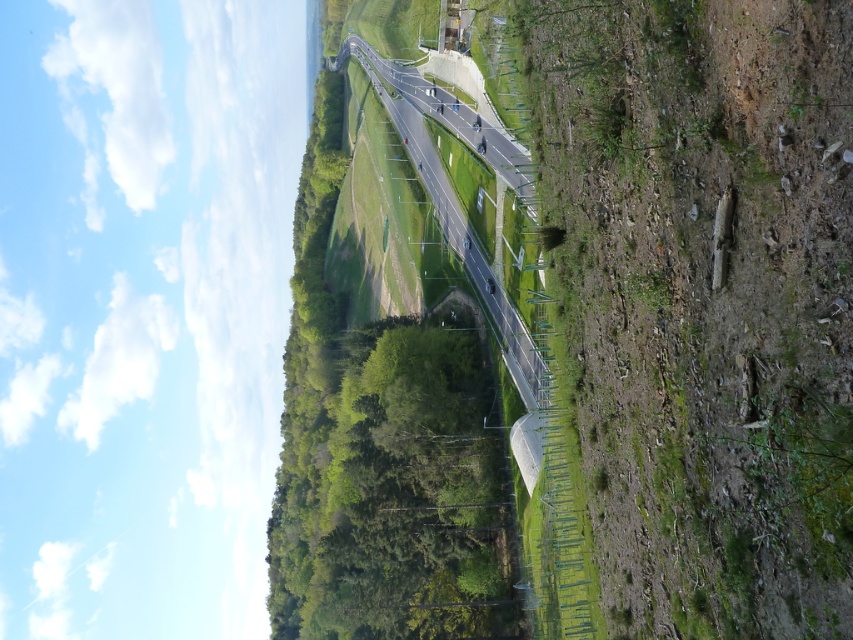
Between dull green grass at lower right and asphalt road at center, which one is positioned lower?

dull green grass at lower right is lower down.

Is dull green grass at lower right positioned in front of asphalt road at center?

Yes, it is in front of asphalt road at center.

Image resolution: width=853 pixels, height=640 pixels. Describe the element at coordinates (704, 301) in the screenshot. I see `dull green grass at lower right` at that location.

Find the location of a particular element. Image resolution: width=853 pixels, height=640 pixels. dull green grass at lower right is located at coordinates (704, 301).